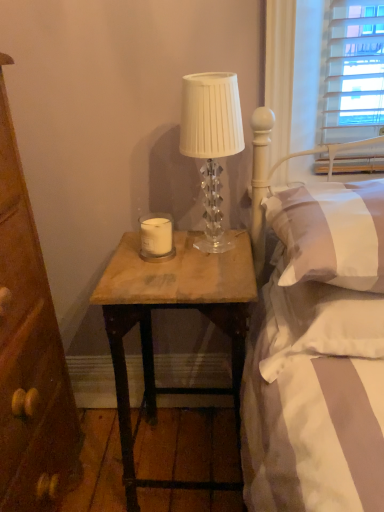
Find the location of a particular element. spots to the right of white matte candle at center is located at coordinates (208, 250).